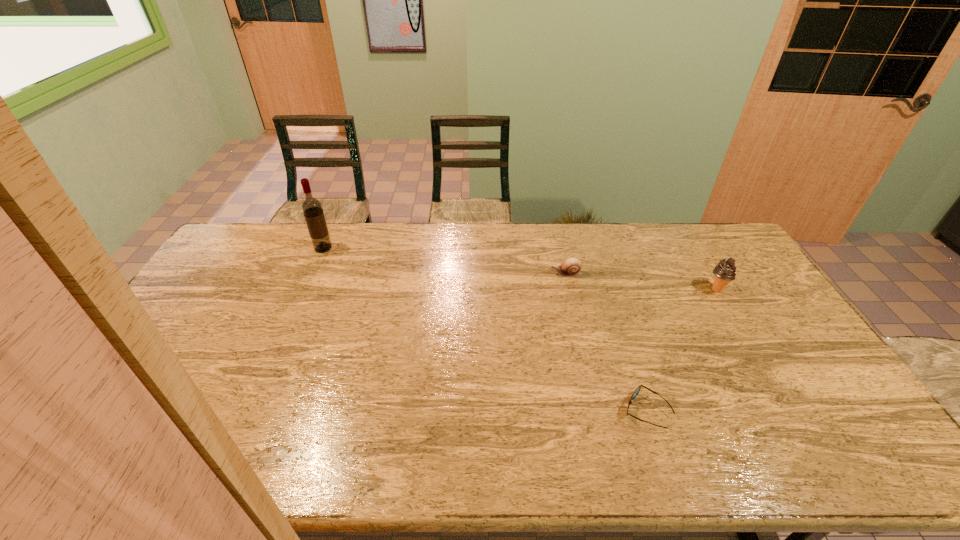
Locate an element on the screen. This screenshot has width=960, height=540. vacant space located on the front-facing side of the third tallest object is located at coordinates (487, 274).

This screenshot has width=960, height=540. I want to click on vacant area located 0.170m on the front-facing side of the third tallest object, so click(x=501, y=274).

Identify the location of vacant space located on the front-facing side of the third tallest object. (533, 274).

You are a GUI agent. You are given a task and a screenshot of the screen. Output one action in this format:
    pyautogui.click(x=<x>, y=<y>)
    Task: Click on the free spot located at the front of the nearest object showing the lenses
    The image size is (960, 540).
    Given the screenshot: What is the action you would take?
    pyautogui.click(x=501, y=411)

Identify the location of free space located 0.050m at the front of the nearest object showing the lenses. The width and height of the screenshot is (960, 540). (603, 411).

The image size is (960, 540). I want to click on vacant region located 0.220m at the front of the nearest object showing the lenses, so click(x=537, y=411).

The image size is (960, 540). I want to click on object situated at the far edge, so click(x=312, y=209).

Locate an element on the screen. object at the right edge is located at coordinates click(x=725, y=271).

This screenshot has width=960, height=540. Find the location of `free space at the far edge of the desktop`. free space at the far edge of the desktop is located at coordinates (369, 221).

This screenshot has width=960, height=540. In order to click on vacant space at the near edge in this screenshot , I will do `click(446, 471)`.